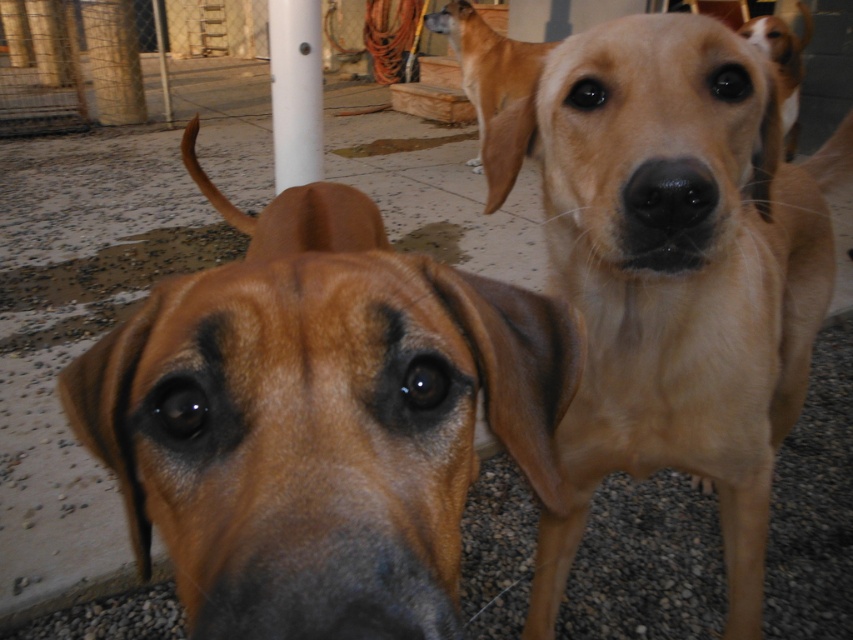
You are standing in the scene and want to walk from the white smooth pole at center to the brown matte dog at center. Which direction should you face to move directly towards the dog?

You should face to the right because the brown matte dog at center is to the right of the white smooth pole at center.

You are standing in a yard and see the brown matte dog at center and the white smooth pole at center. Which object is directly above the other?

The white smooth pole at center is directly above the brown matte dog at center because the brown matte dog at center is positioned under it.